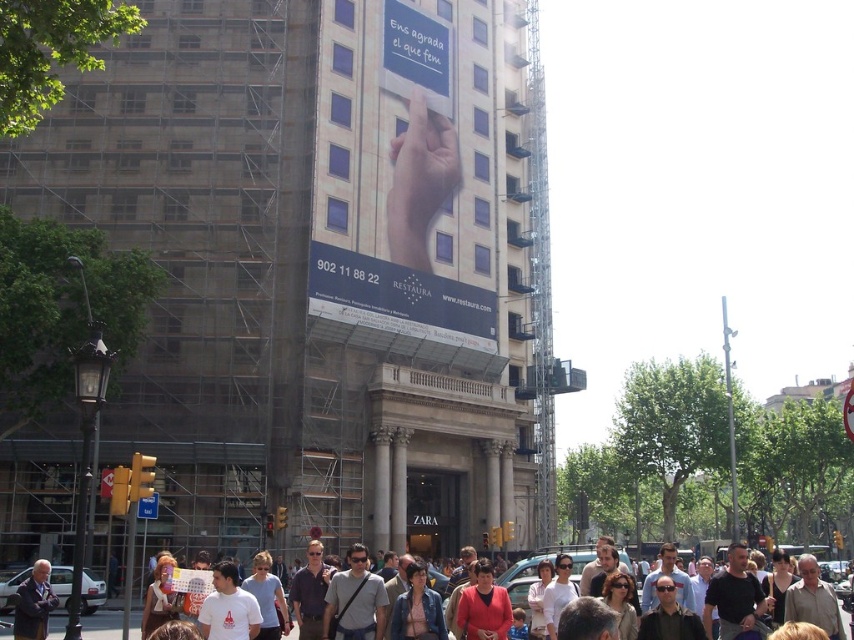
Question: Which point is closer to the camera taking this photo?

Choices:
 (A) (454, 630)
 (B) (459, 304)
 (C) (405, 10)
 (D) (21, 632)

Answer: (D)

Question: Which of these objects is positioned closest to the white paper sign at upper center?

Choices:
 (A) dark gray suit at lower left
 (B) white t-shirt at center

Answer: (B)

Question: Does blue plastic signboard at center have a smaller size compared to dark gray suit at lower left?

Choices:
 (A) no
 (B) yes

Answer: (A)

Question: Is white paper sign at upper center below white t-shirt at center?

Choices:
 (A) no
 (B) yes

Answer: (A)

Question: From the image, what is the correct spatial relationship of blue plastic signboard at center in relation to white t-shirt at center?

Choices:
 (A) above
 (B) below

Answer: (A)

Question: Which point is closer to the camera?

Choices:
 (A) (671, 561)
 (B) (398, 20)
 (C) (16, 628)

Answer: (C)